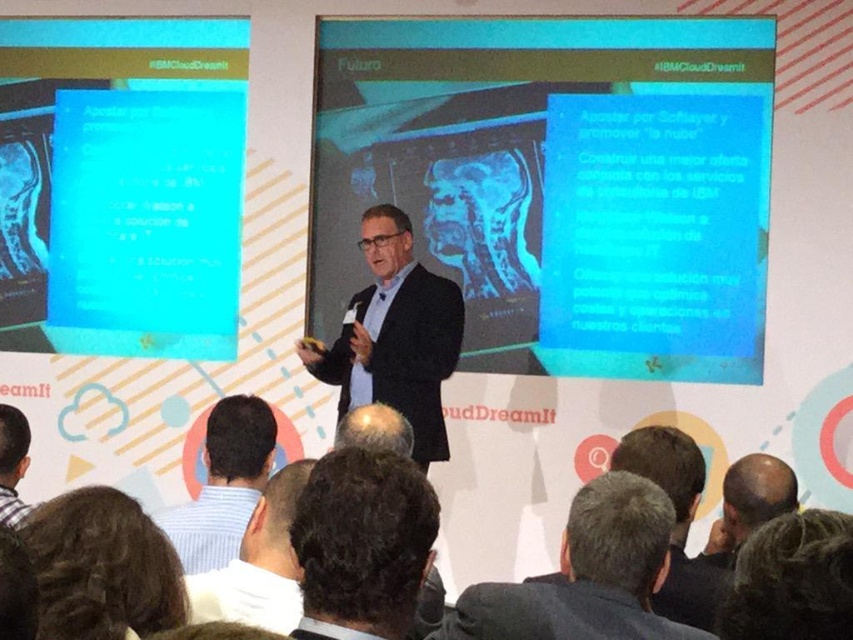
You are a photographer taking a picture of the presentation. You notice two points in the scene at coordinates point (747, 300) and point (773, 595). Which point is closer to your camera lens?

Point (773, 595) is closer to the camera lens because it is less further away than point (747, 300).

You are an attendee at the presentation and want to focus on the speaker. Which object should you look at first, the blue glossy text box at center or the black wool suit at center?

The black wool suit at center is the speaker, so you should look at the black wool suit at center first.

You are an attendee at this presentation and want to take a photo of the blue glossy text box at center and the dark brown hair at lower right. Which one will appear larger in your photo?

The blue glossy text box at center will appear larger in the photo because it is taller than the dark brown hair at lower right.